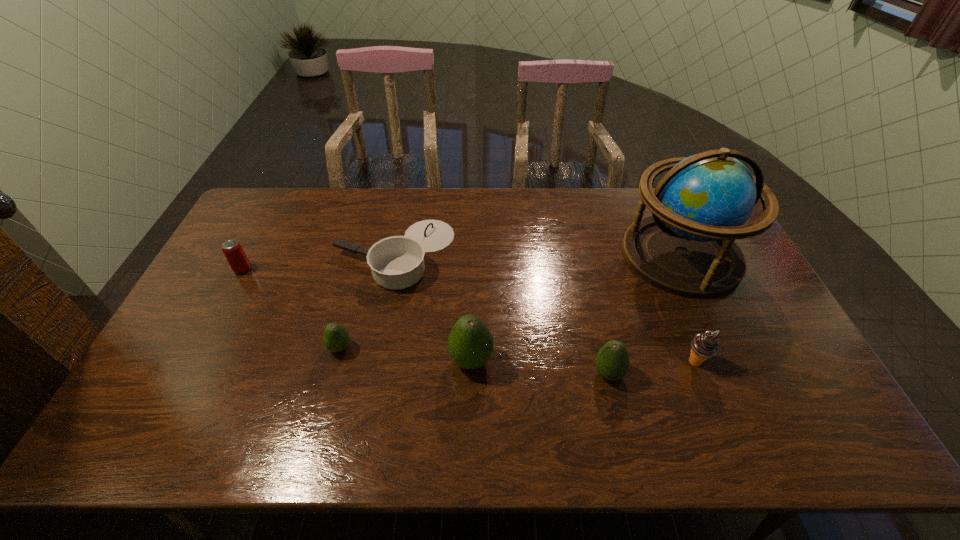
You are a GUI agent. You are given a task and a screenshot of the screen. Output one action in this format:
    pyautogui.click(x=<x>, y=<y>)
    Task: Click on the object that is positioned at the far right corner
    The image size is (960, 540).
    Given the screenshot: What is the action you would take?
    pyautogui.click(x=687, y=247)

At what (x,y) coordinates should I click in order to perform the action: click on vacant region at the far edge of the desktop. Please return your answer as a coordinate pair (x, y). The width and height of the screenshot is (960, 540). Looking at the image, I should click on (605, 216).

I want to click on vacant space at the near edge, so click(x=443, y=393).

This screenshot has width=960, height=540. Identify the location of vacant space at the right edge. click(745, 325).

This screenshot has height=540, width=960. Find the location of `vacant space at the far left corner of the desktop`. vacant space at the far left corner of the desktop is located at coordinates (298, 195).

Where is `free space at the near left corner`? The image size is (960, 540). free space at the near left corner is located at coordinates (179, 396).

This screenshot has height=540, width=960. In order to click on free space between the fifth object from left to right and the fourth object from right to left in this screenshot , I will do `click(540, 367)`.

This screenshot has height=540, width=960. Identify the location of free space between the beer can and the fourth object from right to left. (357, 315).

This screenshot has width=960, height=540. Find the location of `free spot between the saucepan and the tallest avocado`. free spot between the saucepan and the tallest avocado is located at coordinates (433, 307).

Find the location of a particular element. free spot between the icecream and the fourth object from left to right is located at coordinates (583, 361).